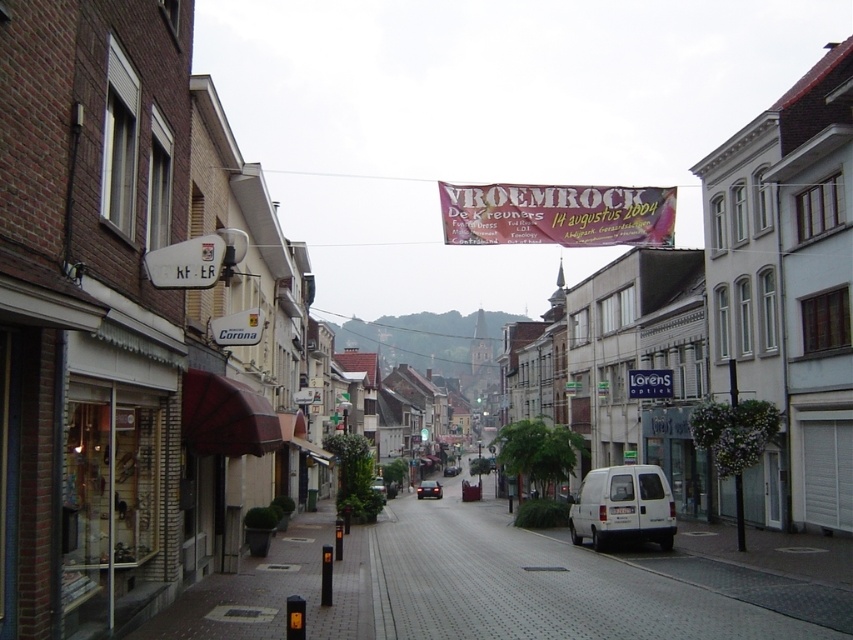
Question: Does white matte van at center appear on the right side of white plastic sign at center?

Choices:
 (A) yes
 (B) no

Answer: (B)

Question: Among these objects, which one is nearest to the camera?

Choices:
 (A) vivid pink fabric banner at center
 (B) white matte van at center

Answer: (B)

Question: Can you confirm if white plastic sign at center is positioned to the left of dark gray metallic van at center?

Choices:
 (A) no
 (B) yes

Answer: (A)

Question: Which point is closer to the camera?

Choices:
 (A) (445, 472)
 (B) (431, 483)
 (C) (670, 390)
 (D) (672, 192)

Answer: (D)

Question: Does white matte van at center appear over shiny black car at center?

Choices:
 (A) yes
 (B) no

Answer: (A)

Question: Which point is farther to the camera?

Choices:
 (A) (657, 396)
 (B) (552, 204)
 (C) (456, 467)
 (D) (618, 504)

Answer: (C)